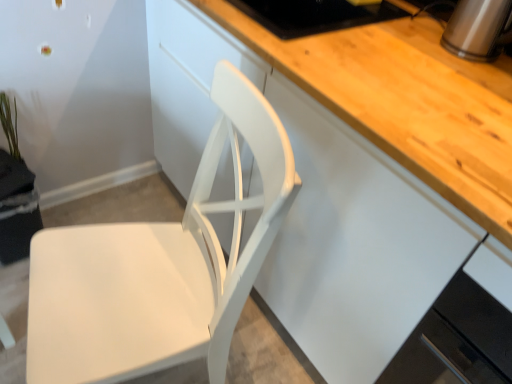
How much space does white glossy cabinet at lower right, which ranks as the 2th cabinetry in top-to-bottom order, occupy horizontally?

white glossy cabinet at lower right, which ranks as the 2th cabinetry in top-to-bottom order, is 24.93 inches wide.

Identify the location of white matte cabinet at center, the second cabinetry when ordered from bottom to top. [x=315, y=205].

What do you see at coordinates (478, 29) in the screenshot? This screenshot has width=512, height=384. I see `satin silver kettle at upper right` at bounding box center [478, 29].

Image resolution: width=512 pixels, height=384 pixels. In order to click on satin silver kettle at upper right in this screenshot , I will do `click(478, 29)`.

What is the approximate width of white matte chair at center?

22.74 inches.

Image resolution: width=512 pixels, height=384 pixels. What are the coordinates of `white glossy cabinet at lower right, which ranks as the 2th cabinetry in top-to-bottom order` in the screenshot? It's located at [463, 327].

Are white glossy cabinet at lower right, which ranks as the 2th cabinetry in top-to-bottom order, and white matte cabinet at center, which appears as the 1th cabinetry when viewed from the top, far apart?

Actually, white glossy cabinet at lower right, which ranks as the 2th cabinetry in top-to-bottom order, and white matte cabinet at center, which appears as the 1th cabinetry when viewed from the top, are a little close together.

Considering the sizes of objects white glossy cabinet at lower right, which ranks as the 2th cabinetry in top-to-bottom order, and white matte cabinet at center, which appears as the 1th cabinetry when viewed from the top, in the image provided, who is taller, white glossy cabinet at lower right, which ranks as the 2th cabinetry in top-to-bottom order, or white matte cabinet at center, which appears as the 1th cabinetry when viewed from the top,?

With more height is white matte cabinet at center, which appears as the 1th cabinetry when viewed from the top.

From a real-world perspective, is white glossy cabinet at lower right, which ranks as the 2th cabinetry in top-to-bottom order, positioned above or below white matte cabinet at center, the second cabinetry when ordered from bottom to top?

Clearly, from a real-world perspective, white glossy cabinet at lower right, which ranks as the 2th cabinetry in top-to-bottom order, is above white matte cabinet at center, the second cabinetry when ordered from bottom to top.

Based on the photo, measure the distance from white glossy cabinet at lower right, the 1th cabinetry ordered from the bottom, to white matte cabinet at center, which appears as the 1th cabinetry when viewed from the top.

white glossy cabinet at lower right, the 1th cabinetry ordered from the bottom, and white matte cabinet at center, which appears as the 1th cabinetry when viewed from the top, are 12.81 inches apart from each other.

From a real-world perspective, is satin silver kettle at upper right above or below white matte cabinet at center, which appears as the 1th cabinetry when viewed from the top?

In terms of real-world spatial position, satin silver kettle at upper right is above white matte cabinet at center, which appears as the 1th cabinetry when viewed from the top.

Can you tell me how much satin silver kettle at upper right and white matte cabinet at center, which appears as the 1th cabinetry when viewed from the top, differ in facing direction?

satin silver kettle at upper right and white matte cabinet at center, which appears as the 1th cabinetry when viewed from the top, are facing 0.453 degrees away from each other.

Does satin silver kettle at upper right turn towards white matte cabinet at center, the second cabinetry when ordered from bottom to top?

No, satin silver kettle at upper right is not aimed at white matte cabinet at center, the second cabinetry when ordered from bottom to top.

Is green matte plant at upper left aimed at white glossy cabinet at lower right, the 1th cabinetry ordered from the bottom?

No, green matte plant at upper left is not aimed at white glossy cabinet at lower right, the 1th cabinetry ordered from the bottom.

How different are the orientations of green matte plant at upper left and white glossy cabinet at lower right, which ranks as the 2th cabinetry in top-to-bottom order, in degrees?

There is a 90.7-degree angle between the facing directions of green matte plant at upper left and white glossy cabinet at lower right, which ranks as the 2th cabinetry in top-to-bottom order.

Does green matte plant at upper left have a greater width compared to white glossy cabinet at lower right, the 1th cabinetry ordered from the bottom?

In fact, green matte plant at upper left might be narrower than white glossy cabinet at lower right, the 1th cabinetry ordered from the bottom.

Which object is positioned more to the left, green matte plant at upper left or white glossy cabinet at lower right, which ranks as the 2th cabinetry in top-to-bottom order?

Positioned to the left is green matte plant at upper left.

Which object is more forward, white matte chair at center or white glossy cabinet at lower right, the 1th cabinetry ordered from the bottom?

Positioned in front is white matte chair at center.

Considering the sizes of white matte chair at center and white glossy cabinet at lower right, which ranks as the 2th cabinetry in top-to-bottom order, in the image, is white matte chair at center wider or thinner than white glossy cabinet at lower right, which ranks as the 2th cabinetry in top-to-bottom order,?

In the image, white matte chair at center appears to be more narrow than white glossy cabinet at lower right, which ranks as the 2th cabinetry in top-to-bottom order.

Is white matte chair at center to the left or to the right of white glossy cabinet at lower right, the 1th cabinetry ordered from the bottom, in the image?

Based on their positions, white matte chair at center is located to the left of white glossy cabinet at lower right, the 1th cabinetry ordered from the bottom.

Considering the relative sizes of white matte chair at center and white glossy cabinet at lower right, which ranks as the 2th cabinetry in top-to-bottom order, in the image provided, is white matte chair at center smaller than white glossy cabinet at lower right, which ranks as the 2th cabinetry in top-to-bottom order,?

Incorrect, white matte chair at center is not smaller in size than white glossy cabinet at lower right, which ranks as the 2th cabinetry in top-to-bottom order.

Considering the sizes of objects green matte plant at upper left and satin silver kettle at upper right in the image provided, who is smaller, green matte plant at upper left or satin silver kettle at upper right?

green matte plant at upper left is smaller.

Is green matte plant at upper left to the left of satin silver kettle at upper right from the viewer's perspective?

Yes.

The width and height of the screenshot is (512, 384). There is a green matte plant at upper left. Find the location of `appliance above it (from a real-world perspective)`. appliance above it (from a real-world perspective) is located at coordinates (478, 29).

Is green matte plant at upper left spatially inside white matte cabinet at center, the second cabinetry when ordered from bottom to top, or outside of it?

green matte plant at upper left exists outside the volume of white matte cabinet at center, the second cabinetry when ordered from bottom to top.

Which object is further away from the camera, green matte plant at upper left or white matte cabinet at center, the second cabinetry when ordered from bottom to top?

green matte plant at upper left is behind.

Is satin silver kettle at upper right inside or outside of green matte plant at upper left?

satin silver kettle at upper right is spatially situated outside green matte plant at upper left.

From a real-world perspective, is satin silver kettle at upper right physically below green matte plant at upper left?

No, from a real-world perspective, satin silver kettle at upper right is not under green matte plant at upper left.

Considering the sizes of objects satin silver kettle at upper right and green matte plant at upper left in the image provided, who is taller, satin silver kettle at upper right or green matte plant at upper left?

green matte plant at upper left.

Based on the photo, from the image's perspective, does satin silver kettle at upper right appear lower than green matte plant at upper left?

No, from the image's perspective, satin silver kettle at upper right is not below green matte plant at upper left.

Identify the location of cabinetry below the white glossy cabinet at lower right, which ranks as the 2th cabinetry in top-to-bottom order (from a real-world perspective). This screenshot has height=384, width=512. (315, 205).

Image resolution: width=512 pixels, height=384 pixels. I want to click on appliance that is above the white matte cabinet at center, the second cabinetry when ordered from bottom to top (from a real-world perspective), so click(478, 29).

Based on their spatial positions, is green matte plant at upper left or satin silver kettle at upper right closer to white glossy cabinet at lower right, which ranks as the 2th cabinetry in top-to-bottom order?

satin silver kettle at upper right.

Considering their positions, is green matte plant at upper left positioned further to white matte cabinet at center, the second cabinetry when ordered from bottom to top, than white matte chair at center?

green matte plant at upper left is further to white matte cabinet at center, the second cabinetry when ordered from bottom to top.

Estimate the real-world distances between objects in this image. Which object is further from white glossy cabinet at lower right, the 1th cabinetry ordered from the bottom, green matte plant at upper left or white matte cabinet at center, the second cabinetry when ordered from bottom to top?

green matte plant at upper left is positioned further to the anchor white glossy cabinet at lower right, the 1th cabinetry ordered from the bottom.

Looking at the image, which one is located closer to satin silver kettle at upper right, white matte cabinet at center, the second cabinetry when ordered from bottom to top, or white matte chair at center?

white matte cabinet at center, the second cabinetry when ordered from bottom to top, is closer to satin silver kettle at upper right.

Estimate the real-world distances between objects in this image. Which object is further from satin silver kettle at upper right, white matte chair at center or white glossy cabinet at lower right, the 1th cabinetry ordered from the bottom?

Among the two, white matte chair at center is located further to satin silver kettle at upper right.

Estimate the real-world distances between objects in this image. Which object is further from satin silver kettle at upper right, white matte chair at center or white matte cabinet at center, the second cabinetry when ordered from bottom to top?

white matte chair at center.

From the picture: Considering their positions, is green matte plant at upper left positioned closer to white matte cabinet at center, which appears as the 1th cabinetry when viewed from the top, than white glossy cabinet at lower right, which ranks as the 2th cabinetry in top-to-bottom order?

white glossy cabinet at lower right, which ranks as the 2th cabinetry in top-to-bottom order.

Considering their positions, is satin silver kettle at upper right positioned further to white matte chair at center than white glossy cabinet at lower right, which ranks as the 2th cabinetry in top-to-bottom order?

satin silver kettle at upper right lies further to white matte chair at center than the other object.

Locate an element on the screen. The height and width of the screenshot is (384, 512). cabinetry between white matte chair at center and satin silver kettle at upper right is located at coordinates (315, 205).

Locate an element on the screen. Image resolution: width=512 pixels, height=384 pixels. appliance between green matte plant at upper left and white glossy cabinet at lower right, which ranks as the 2th cabinetry in top-to-bottom order, in the horizontal direction is located at coordinates (478, 29).

You are a GUI agent. You are given a task and a screenshot of the screen. Output one action in this format:
    pyautogui.click(x=<x>, y=<y>)
    Task: Click on the cabinetry situated between green matte plant at upper left and white glossy cabinet at lower right, which ranks as the 2th cabinetry in top-to-bottom order, from left to right
    Image resolution: width=512 pixels, height=384 pixels.
    Given the screenshot: What is the action you would take?
    315,205

Locate an element on the screen. This screenshot has height=384, width=512. chair located between green matte plant at upper left and white matte cabinet at center, which appears as the 1th cabinetry when viewed from the top, in the left-right direction is located at coordinates (160, 266).